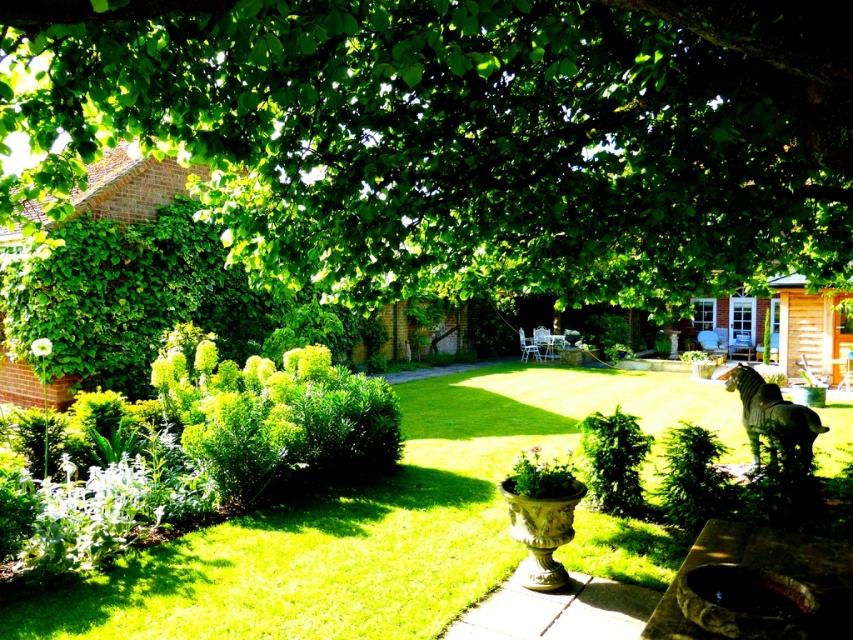
Question: Which point is closer to the camera taking this photo?

Choices:
 (A) (686, 547)
 (B) (392, 154)

Answer: (B)

Question: From the image, what is the correct spatial relationship of green leafy tree at upper center in relation to bronze statue at center?

Choices:
 (A) above
 (B) below

Answer: (A)

Question: Which point appears farthest from the camera in this image?

Choices:
 (A) (845, 58)
 (B) (488, 436)

Answer: (B)

Question: Which of the following is the farthest from the observer?

Choices:
 (A) bronze statue at center
 (B) green leafy tree at upper center

Answer: (A)

Question: Does green leafy tree at upper center have a smaller size compared to bronze statue at center?

Choices:
 (A) yes
 (B) no

Answer: (A)

Question: Does green leafy tree at upper center appear on the right side of bronze statue at center?

Choices:
 (A) yes
 (B) no

Answer: (B)